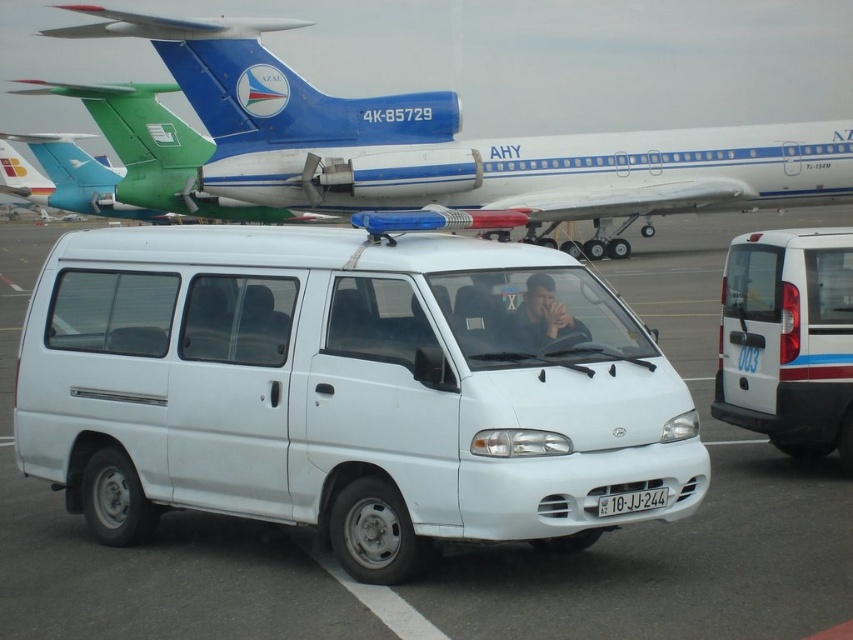
Does white matte van at center have a lesser width compared to white matte van at right?

Yes, white matte van at center is thinner than white matte van at right.

Which is more to the left, white matte van at center or white matte van at right?

From the viewer's perspective, white matte van at center appears more on the left side.

This screenshot has height=640, width=853. What do you see at coordinates (341, 390) in the screenshot?
I see `white matte van at center` at bounding box center [341, 390].

You are a GUI agent. You are given a task and a screenshot of the screen. Output one action in this format:
    pyautogui.click(x=<x>, y=<y>)
    Task: Click on the white matte van at center
    
    Given the screenshot: What is the action you would take?
    pyautogui.click(x=341, y=390)

Who is shorter, blue metallic airplane at center or white matte van at right?

Standing shorter between the two is white matte van at right.

Is blue metallic airplane at center positioned before white matte van at right?

No, it is not.

Is point (224, 48) closer to camera compared to point (753, 340)?

No, it is behind (753, 340).

You are a GUI agent. You are given a task and a screenshot of the screen. Output one action in this format:
    pyautogui.click(x=<x>, y=<y>)
    Task: Click on the blue metallic airplane at center
    
    Given the screenshot: What is the action you would take?
    pyautogui.click(x=453, y=141)

Is white matte van at center to the right of white plastic license plate at center from the viewer's perspective?

Incorrect, white matte van at center is not on the right side of white plastic license plate at center.

Describe the element at coordinates (341, 390) in the screenshot. I see `white matte van at center` at that location.

This screenshot has width=853, height=640. Identify the location of white matte van at center. (341, 390).